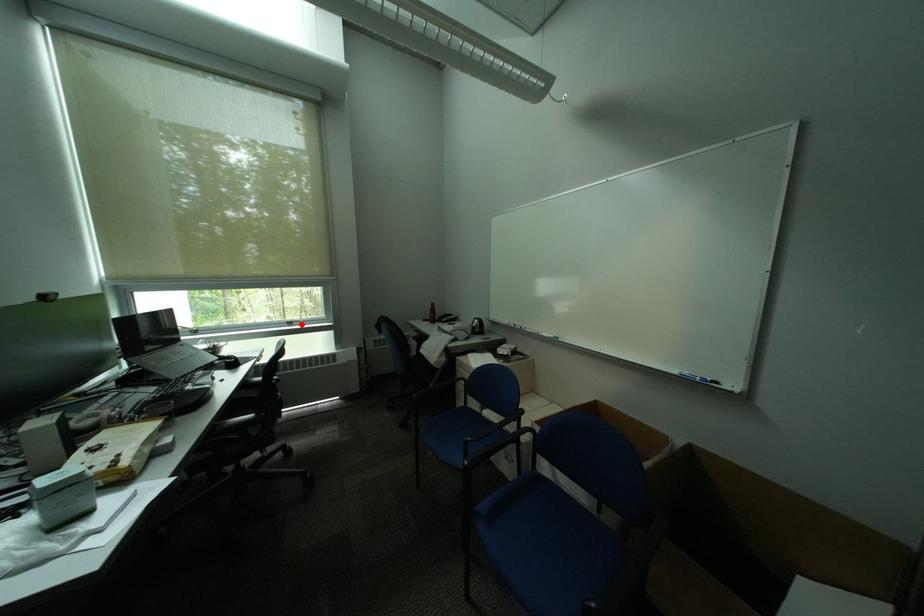
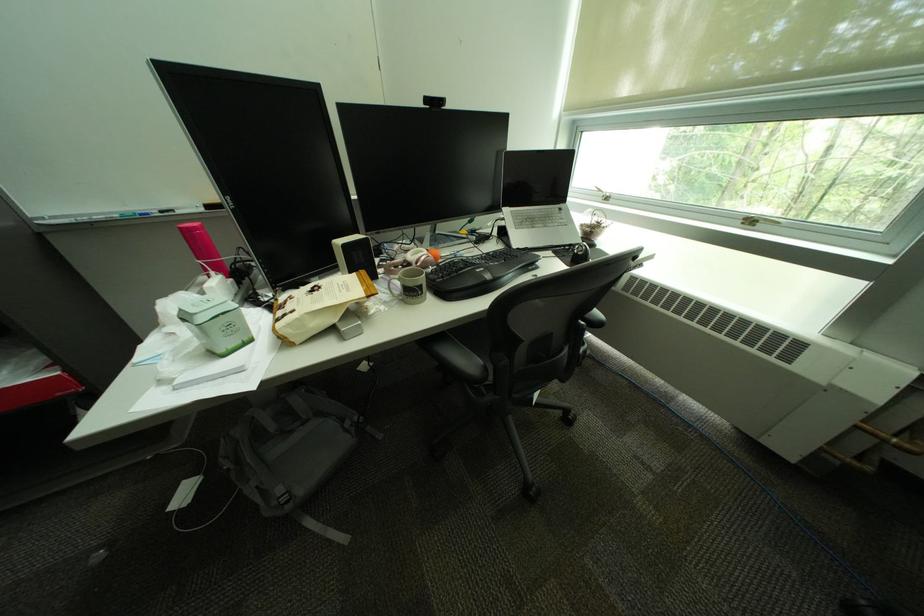
The point at the highlighted location is marked in the first image. Where is the corresponding point in the second image?

(761, 224)